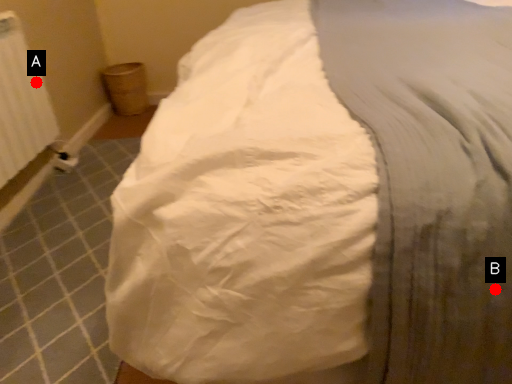
Question: Two points are circled on the image, labeled by A and B beside each circle. Among these points, which one is farthest from the camera?

Choices:
 (A) A is further
 (B) B is further

Answer: (A)